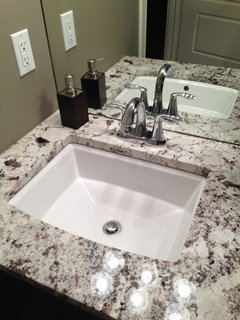
Locate an element on the screen. This screenshot has width=240, height=320. inset sink is located at coordinates (143, 219).